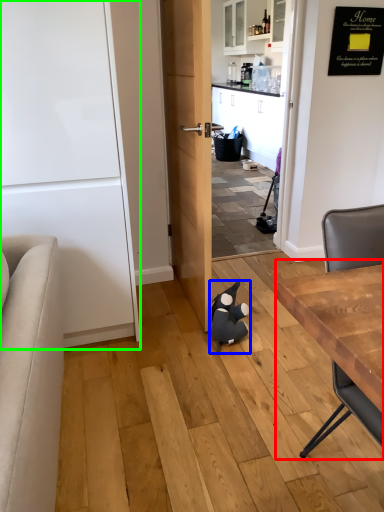
Question: Which object is positioned farthest from table (highlighted by a red box)? Select from animal (highlighted by a blue box) and door (highlighted by a green box).

Choices:
 (A) animal
 (B) door

Answer: (B)